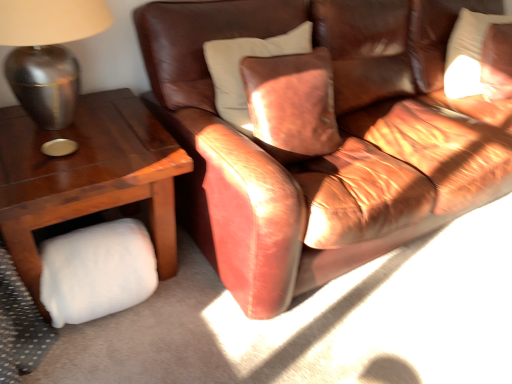
Question: Is white soft pillow at upper right located within leather couch at center?

Choices:
 (A) no
 (B) yes

Answer: (B)

Question: Is leather couch at center aimed at white soft pillow at upper right?

Choices:
 (A) yes
 (B) no

Answer: (A)

Question: From a real-world perspective, is leather couch at center below white soft pillow at upper right?

Choices:
 (A) no
 (B) yes

Answer: (B)

Question: Are leather couch at center and white soft pillow at upper right beside each other?

Choices:
 (A) no
 (B) yes

Answer: (A)

Question: Is leather couch at center oriented away from white soft pillow at upper right?

Choices:
 (A) yes
 (B) no

Answer: (A)

Question: From a real-world perspective, is leather couch at center positioned over white soft pillow at upper right based on gravity?

Choices:
 (A) no
 (B) yes

Answer: (A)

Question: Is metallic silver lamp at left oriented away from woodenobject at left?

Choices:
 (A) no
 (B) yes

Answer: (A)

Question: Is metallic silver lamp at left further to camera compared to woodenobject at left?

Choices:
 (A) yes
 (B) no

Answer: (B)

Question: Can you confirm if metallic silver lamp at left is thinner than woodenobject at left?

Choices:
 (A) yes
 (B) no

Answer: (A)

Question: From the image's perspective, is metallic silver lamp at left below woodenobject at left?

Choices:
 (A) yes
 (B) no

Answer: (B)

Question: Could you tell me if metallic silver lamp at left is turned towards woodenobject at left?

Choices:
 (A) no
 (B) yes

Answer: (A)

Question: Are metallic silver lamp at left and woodenobject at left located far from each other?

Choices:
 (A) yes
 (B) no

Answer: (B)

Question: From the image's perspective, is white fluffy pillow at lower left on white soft pillow at upper right?

Choices:
 (A) no
 (B) yes

Answer: (A)